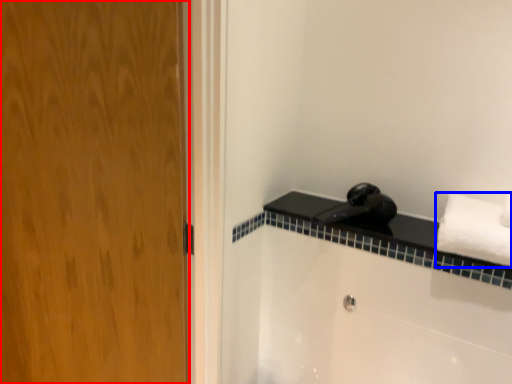
Question: Which object is further to the camera taking this photo, door (highlighted by a red box) or towel (highlighted by a blue box)?

Choices:
 (A) door
 (B) towel

Answer: (B)